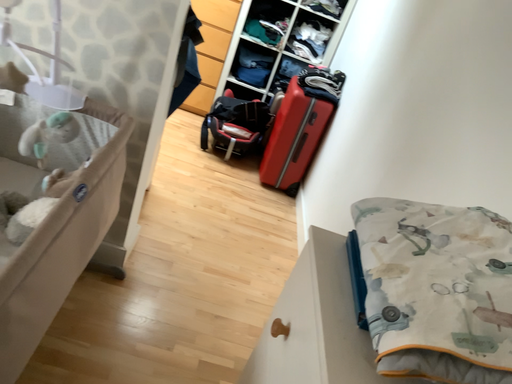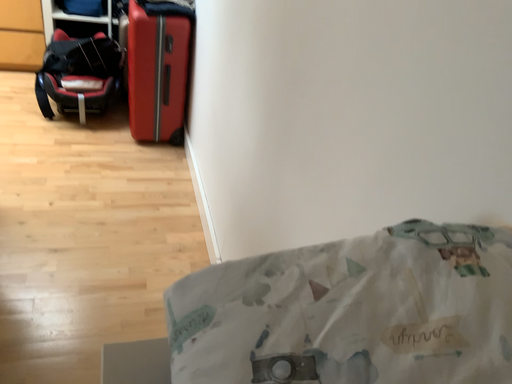
Question: How did the camera likely rotate when shooting the video?

Choices:
 (A) rotated downward
 (B) rotated upward

Answer: (A)